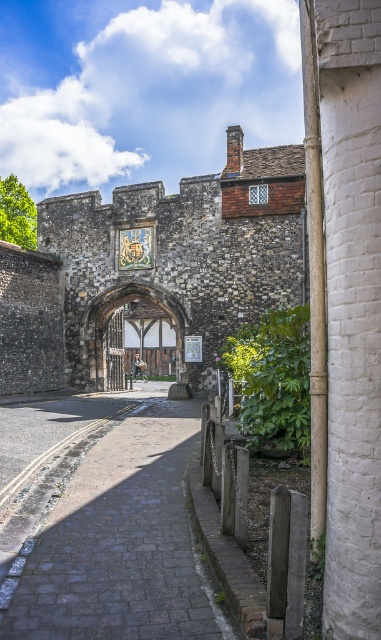
Question: Which point appears farthest from the camera in this image?

Choices:
 (A) (134, 416)
 (B) (104, 305)

Answer: (B)

Question: Observing the image, what is the correct spatial positioning of gray cobblestone path at center in reference to wooden timber archway at center?

Choices:
 (A) left
 (B) right

Answer: (B)

Question: Which point is farther to the camera?

Choices:
 (A) (177, 506)
 (B) (171, 369)

Answer: (B)

Question: Which of the following is the closest to the observer?

Choices:
 (A) (153, 604)
 (B) (147, 284)

Answer: (A)

Question: Does gray cobblestone path at center have a lesser width compared to wooden timber archway at center?

Choices:
 (A) no
 (B) yes

Answer: (B)

Question: Where is gray cobblestone path at center located in relation to wooden timber archway at center in the image?

Choices:
 (A) left
 (B) right

Answer: (B)